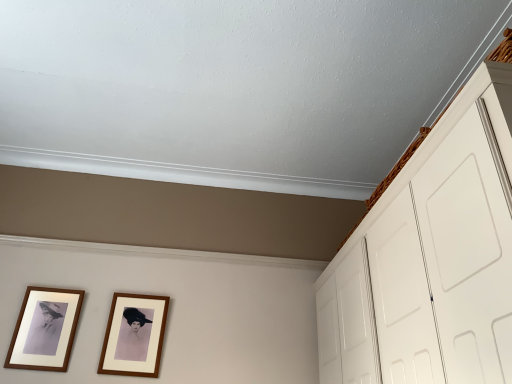
Question: Can you confirm if wooden framed photo at lower left, the 2th picture frame positioned from the right, is smaller than brown wooden picture frame at center, the first picture frame when ordered from right to left?

Choices:
 (A) yes
 (B) no

Answer: (A)

Question: Can you confirm if wooden framed photo at lower left, the 2th picture frame positioned from the right, is positioned to the right of brown wooden picture frame at center, the first picture frame when ordered from right to left?

Choices:
 (A) yes
 (B) no

Answer: (B)

Question: Does wooden framed photo at lower left, marked as the first picture frame in a left-to-right arrangement, turn towards brown wooden picture frame at center, positioned as the 2th picture frame in left-to-right order?

Choices:
 (A) yes
 (B) no

Answer: (B)

Question: From a real-world perspective, is wooden framed photo at lower left, marked as the first picture frame in a left-to-right arrangement, on brown wooden picture frame at center, the first picture frame when ordered from right to left?

Choices:
 (A) no
 (B) yes

Answer: (B)

Question: From the image's perspective, would you say wooden framed photo at lower left, the 2th picture frame positioned from the right, is positioned over brown wooden picture frame at center, the first picture frame when ordered from right to left?

Choices:
 (A) yes
 (B) no

Answer: (A)

Question: From the image's perspective, is wooden framed photo at lower left, the 2th picture frame positioned from the right, located above or below brown wooden picture frame at center, the first picture frame when ordered from right to left?

Choices:
 (A) below
 (B) above

Answer: (B)

Question: Considering the positions of wooden framed photo at lower left, marked as the first picture frame in a left-to-right arrangement, and brown wooden picture frame at center, positioned as the 2th picture frame in left-to-right order, in the image, is wooden framed photo at lower left, marked as the first picture frame in a left-to-right arrangement, wider or thinner than brown wooden picture frame at center, positioned as the 2th picture frame in left-to-right order,?

Choices:
 (A) thin
 (B) wide

Answer: (A)

Question: From a real-world perspective, relative to brown wooden picture frame at center, positioned as the 2th picture frame in left-to-right order, is wooden framed photo at lower left, marked as the first picture frame in a left-to-right arrangement, vertically above or below?

Choices:
 (A) above
 (B) below

Answer: (A)

Question: Is wooden framed photo at lower left, the 2th picture frame positioned from the right, spatially inside brown wooden picture frame at center, positioned as the 2th picture frame in left-to-right order, or outside of it?

Choices:
 (A) outside
 (B) inside

Answer: (A)

Question: Looking at their shapes, would you say wooden framed photo at lower left, marked as the first picture frame in a left-to-right arrangement, is wider or thinner than white matte cabinet at upper right?

Choices:
 (A) thin
 (B) wide

Answer: (A)

Question: Considering their positions, is wooden framed photo at lower left, marked as the first picture frame in a left-to-right arrangement, located in front of or behind white matte cabinet at upper right?

Choices:
 (A) behind
 (B) front

Answer: (A)

Question: Is wooden framed photo at lower left, the 2th picture frame positioned from the right, bigger or smaller than white matte cabinet at upper right?

Choices:
 (A) small
 (B) big

Answer: (A)

Question: From the image's perspective, is wooden framed photo at lower left, marked as the first picture frame in a left-to-right arrangement, above or below white matte cabinet at upper right?

Choices:
 (A) below
 (B) above

Answer: (A)

Question: Based on their sizes in the image, would you say brown wooden picture frame at center, positioned as the 2th picture frame in left-to-right order, is bigger or smaller than wooden framed photo at lower left, the 2th picture frame positioned from the right?

Choices:
 (A) big
 (B) small

Answer: (A)

Question: Does point (145, 344) appear closer or farther from the camera than point (40, 296)?

Choices:
 (A) farther
 (B) closer

Answer: (B)